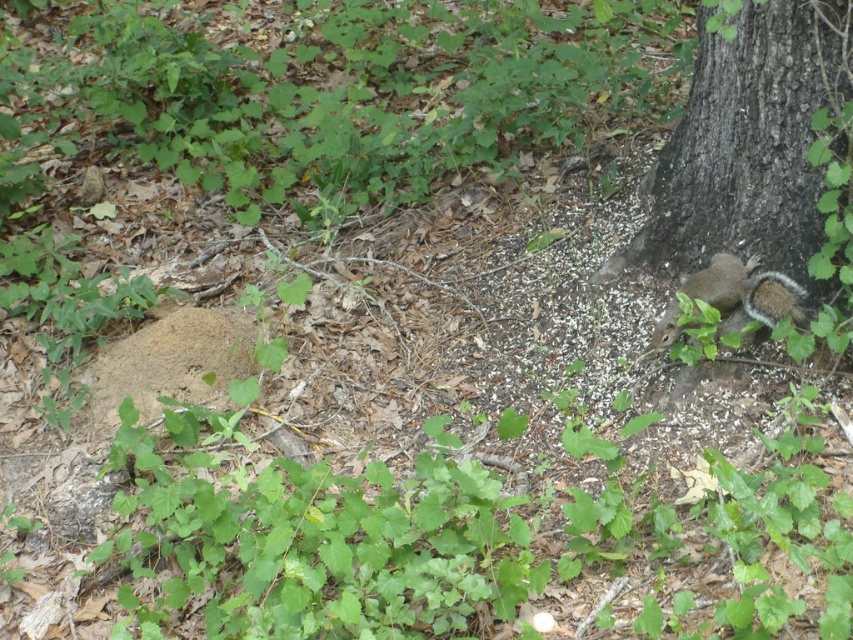
Is point (761, 52) positioned after point (674, 326)?

No, it is in front of (674, 326).

Between point (647, 218) and point (750, 259), which one is positioned in front?

Point (750, 259) is more forward.

I want to click on brown rough bark tree at lower right, so click(747, 141).